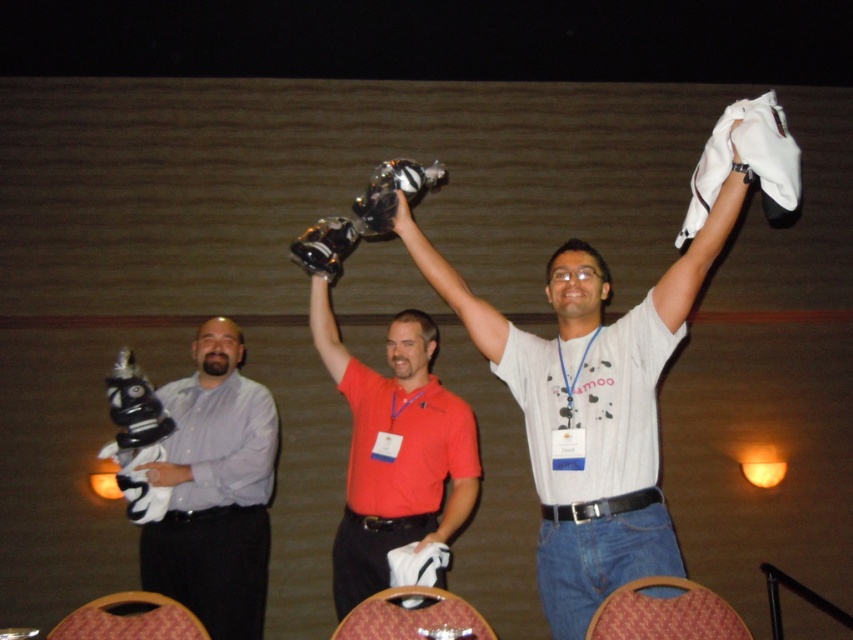
Question: Which point is farther from the camera taking this photo?

Choices:
 (A) (323, 285)
 (B) (704, 588)
 (C) (126, 592)
 (D) (367, 627)

Answer: (A)

Question: Which is nearer to the leather textured chair at lower center?

Choices:
 (A) wooden textured chair at lower center
 (B) red matte shirt at center
 (C) wooden chair at lower left
 (D) brushed metal trophy at left

Answer: (B)

Question: Which of the following is the farthest from the observer?

Choices:
 (A) leather textured chair at lower center
 (B) wooden textured chair at lower center

Answer: (B)

Question: Does white matte t-shirt at center have a lesser width compared to wooden textured chair at lower center?

Choices:
 (A) yes
 (B) no

Answer: (B)

Question: Does white matte t-shirt at center lie behind brushed metal trophy at left?

Choices:
 (A) no
 (B) yes

Answer: (A)

Question: Does red matte shirt at center have a smaller size compared to wooden textured chair at lower center?

Choices:
 (A) yes
 (B) no

Answer: (B)